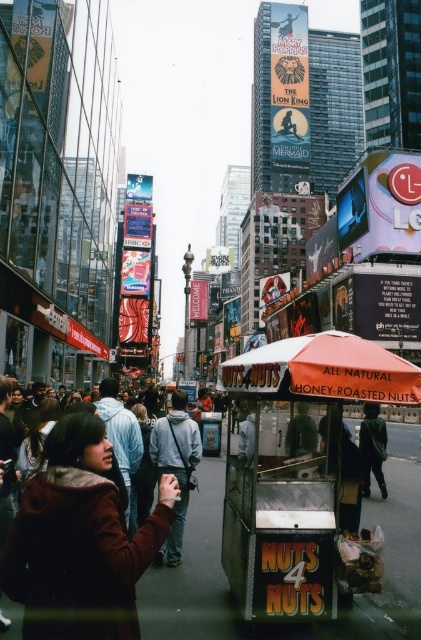
Does orange fabric umbrella at center appear under gray fabric jacket at center?

Incorrect, orange fabric umbrella at center is not positioned below gray fabric jacket at center.

Based on the photo, does orange fabric umbrella at center have a smaller size compared to gray fabric jacket at center?

No, orange fabric umbrella at center is not smaller than gray fabric jacket at center.

Is point (410, 394) farther from viewer compared to point (173, 410)?

That is False.

The width and height of the screenshot is (421, 640). In order to click on orange fabric umbrella at center in this screenshot , I will do `click(324, 371)`.